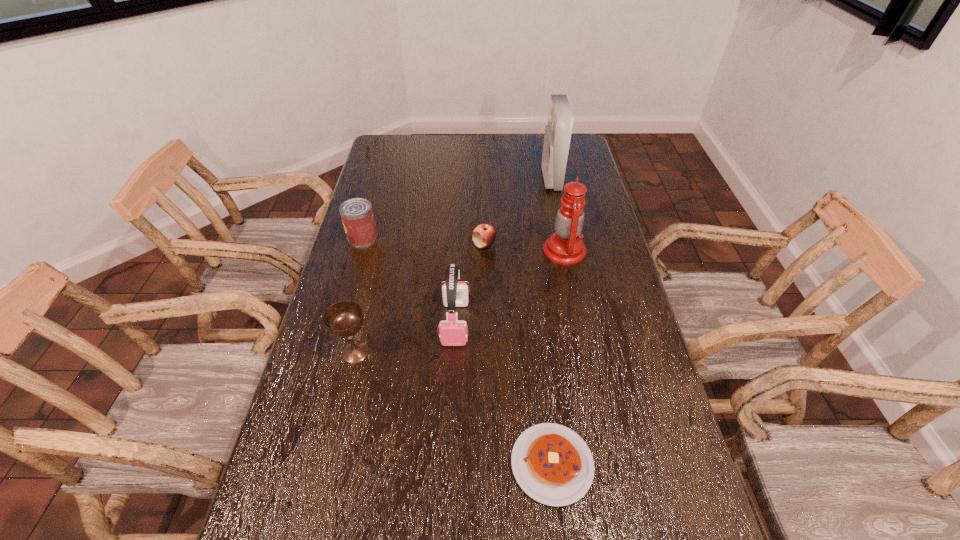
What are the coordinates of `can situated at the left edge` in the screenshot? It's located at (357, 216).

Locate an element on the screen. The width and height of the screenshot is (960, 540). the first-aid kit that is at the right edge is located at coordinates (557, 136).

Find the location of a particular element. The image size is (960, 540). oil lamp situated at the right edge is located at coordinates (565, 246).

The width and height of the screenshot is (960, 540). Find the location of `free region at the far edge`. free region at the far edge is located at coordinates (535, 136).

In the image, there is a desktop. Find the location of `free space at the left edge`. free space at the left edge is located at coordinates (371, 312).

The image size is (960, 540). Find the location of `free space at the right edge of the desktop`. free space at the right edge of the desktop is located at coordinates (636, 353).

Locate an element on the screen. The image size is (960, 540). free region at the far left corner of the desktop is located at coordinates (389, 141).

What are the coordinates of `vacant area that lies between the fourth object from left to right and the nearest object` in the screenshot? It's located at (518, 354).

Find the location of a particular element. The width and height of the screenshot is (960, 540). empty space between the fourth shortest object and the third shortest object is located at coordinates pyautogui.click(x=359, y=294).

The height and width of the screenshot is (540, 960). I want to click on vacant area that lies between the nearest object and the oil lamp, so click(x=558, y=357).